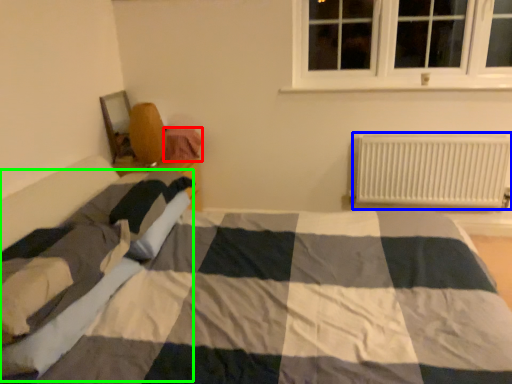
Question: Which object is the farthest from material (highlighted by a red box)? Choose among these: radiator (highlighted by a blue box) or blanket (highlighted by a green box).

Choices:
 (A) radiator
 (B) blanket

Answer: (A)